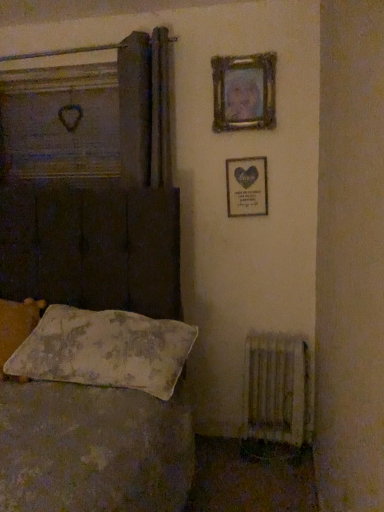
Question: From a real-world perspective, is wooden frame at upper right, positioned as the second picture frame in bottom-to-top order, over floral fabric pillow at lower left, acting as the 1th pillow starting from the right?

Choices:
 (A) yes
 (B) no

Answer: (A)

Question: Is floral fabric pillow at lower left, which is the 2th pillow from left to right, at the back of wooden frame at upper right, positioned as the second picture frame in bottom-to-top order?

Choices:
 (A) yes
 (B) no

Answer: (B)

Question: Is wooden frame at upper right, arranged as the first picture frame when viewed from the top, behind floral fabric pillow at lower left, which is the 2th pillow from left to right?

Choices:
 (A) yes
 (B) no

Answer: (A)

Question: Does wooden frame at upper right, arranged as the first picture frame when viewed from the top, have a greater height compared to floral fabric pillow at lower left, acting as the 1th pillow starting from the right?

Choices:
 (A) yes
 (B) no

Answer: (A)

Question: Is floral fabric pillow at lower left, acting as the 1th pillow starting from the right, a part of wooden frame at upper right, arranged as the first picture frame when viewed from the top?

Choices:
 (A) yes
 (B) no

Answer: (B)

Question: Does wooden frame at upper right, positioned as the second picture frame in bottom-to-top order, have a lesser width compared to floral fabric pillow at lower left, acting as the 1th pillow starting from the right?

Choices:
 (A) yes
 (B) no

Answer: (A)

Question: From a real-world perspective, is fluffy white pillow at lower left, which ranks as the second pillow in right-to-left order, below wooden frame at upper right, positioned as the second picture frame in bottom-to-top order?

Choices:
 (A) no
 (B) yes

Answer: (B)

Question: Does fluffy white pillow at lower left, which ranks as the second pillow in right-to-left order, have a smaller size compared to wooden frame at upper right, arranged as the first picture frame when viewed from the top?

Choices:
 (A) no
 (B) yes

Answer: (A)

Question: From the image's perspective, does fluffy white pillow at lower left, which ranks as the second pillow in right-to-left order, appear lower than wooden frame at upper right, positioned as the second picture frame in bottom-to-top order?

Choices:
 (A) yes
 (B) no

Answer: (A)

Question: Is wooden frame at upper right, arranged as the first picture frame when viewed from the top, inside fluffy white pillow at lower left, which ranks as the second pillow in right-to-left order?

Choices:
 (A) yes
 (B) no

Answer: (B)

Question: Can you confirm if fluffy white pillow at lower left, which ranks as the second pillow in right-to-left order, is thinner than wooden frame at upper right, positioned as the second picture frame in bottom-to-top order?

Choices:
 (A) yes
 (B) no

Answer: (B)

Question: Is fluffy white pillow at lower left, which ranks as the second pillow in right-to-left order, positioned far away from wooden frame at upper right, arranged as the first picture frame when viewed from the top?

Choices:
 (A) no
 (B) yes

Answer: (B)

Question: Is wooden frame with heart at upper right, positioned as the second picture frame in top-to-bottom order, surrounding white textured radiator at lower right?

Choices:
 (A) no
 (B) yes

Answer: (A)